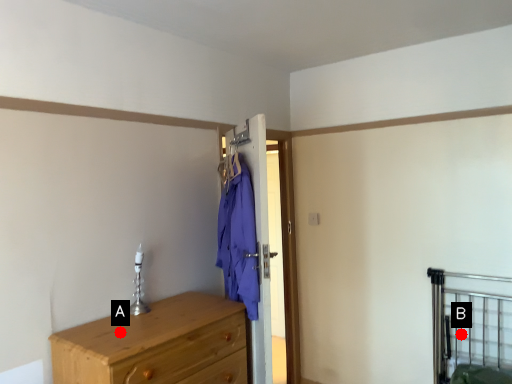
Question: Two points are circled on the image, labeled by A and B beside each circle. Which point is farther to the camera?

Choices:
 (A) A is further
 (B) B is further

Answer: (B)